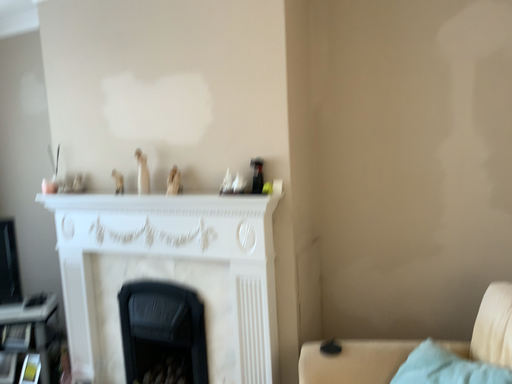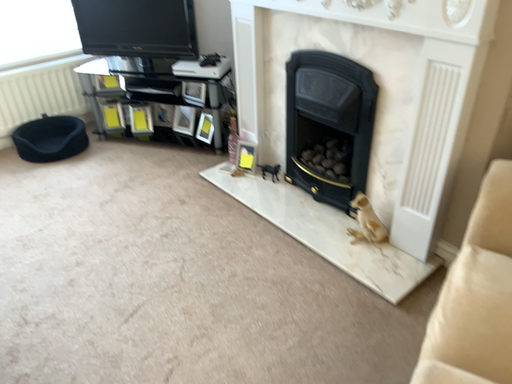
Question: How did the camera likely rotate when shooting the video?

Choices:
 (A) rotated downward
 (B) rotated upward

Answer: (A)